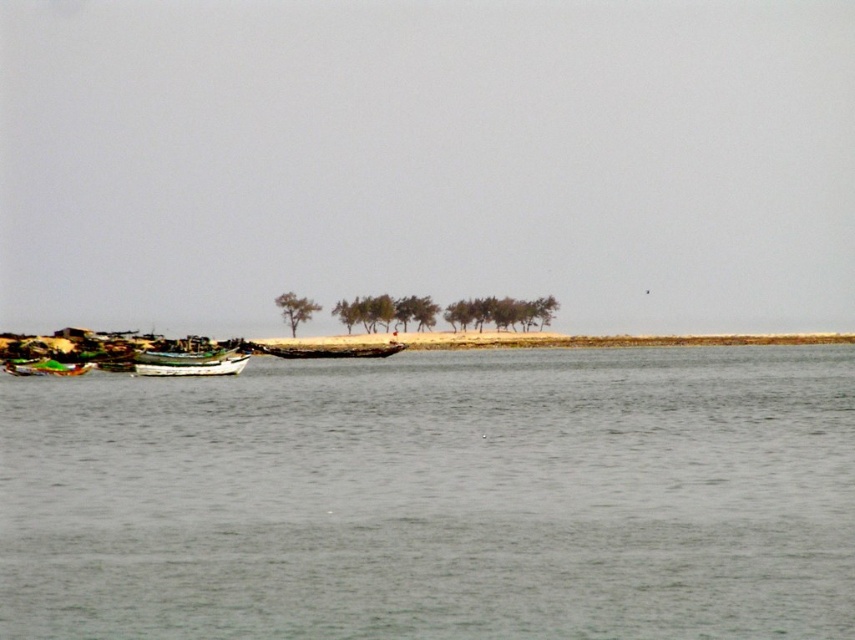
Question: Which point is farther from the camera taking this photo?

Choices:
 (A) (286, 298)
 (B) (180, 356)
 (C) (310, 356)
 (D) (71, 372)

Answer: (A)

Question: Considering the relative positions of green painted wooden boat at center and green plastic boat at left in the image provided, where is green painted wooden boat at center located with respect to green plastic boat at left?

Choices:
 (A) left
 (B) right

Answer: (B)

Question: Which object appears closest to the camera in this image?

Choices:
 (A) green painted wooden boat at center
 (B) wooden boat at center

Answer: (A)

Question: Which of the following is the farthest from the observer?

Choices:
 (A) green matte tree at center
 (B) wooden boat at center

Answer: (A)

Question: Where is clear water at center located in relation to green painted wooden boat at center in the image?

Choices:
 (A) left
 (B) right

Answer: (B)

Question: In this image, where is green painted wooden boat at center located relative to wooden boat at center?

Choices:
 (A) right
 (B) left

Answer: (B)